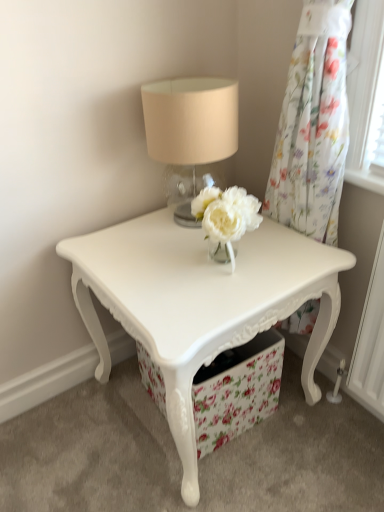
Identify the location of free space to the left of matte glass table lamp at upper center. (125, 234).